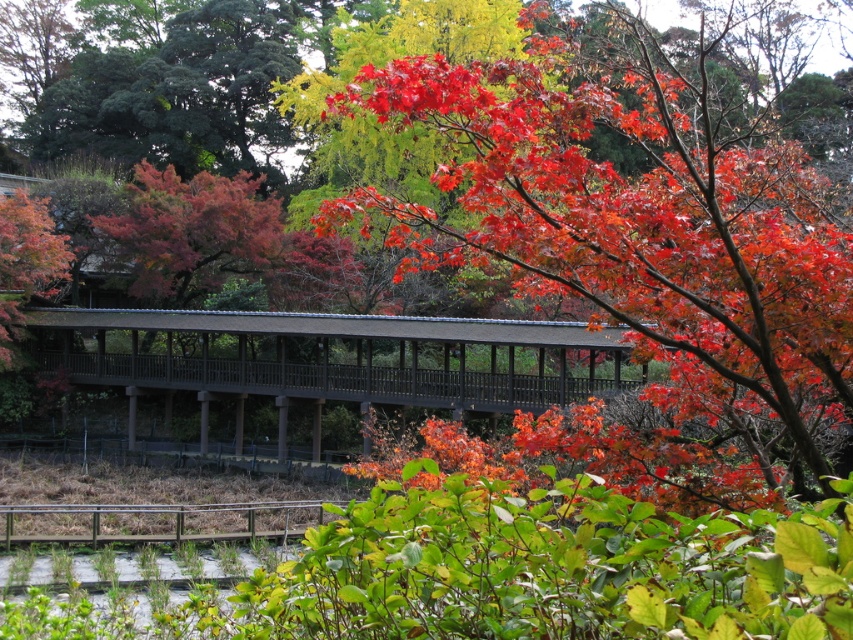
Question: Can you confirm if shiny red maple at center is positioned to the right of brown wooden bridge at center?

Choices:
 (A) no
 (B) yes

Answer: (B)

Question: Can you confirm if shiny red maple at center is smaller than brown wooden bridge at center?

Choices:
 (A) no
 (B) yes

Answer: (A)

Question: Does shiny red maple at center appear on the right side of brown wooden bridge at center?

Choices:
 (A) yes
 (B) no

Answer: (A)

Question: Which point appears closest to the camera in this image?

Choices:
 (A) (318, 360)
 (B) (587, 282)

Answer: (B)

Question: Which of the following is the closest to the observer?

Choices:
 (A) (378, 209)
 (B) (476, 317)

Answer: (A)